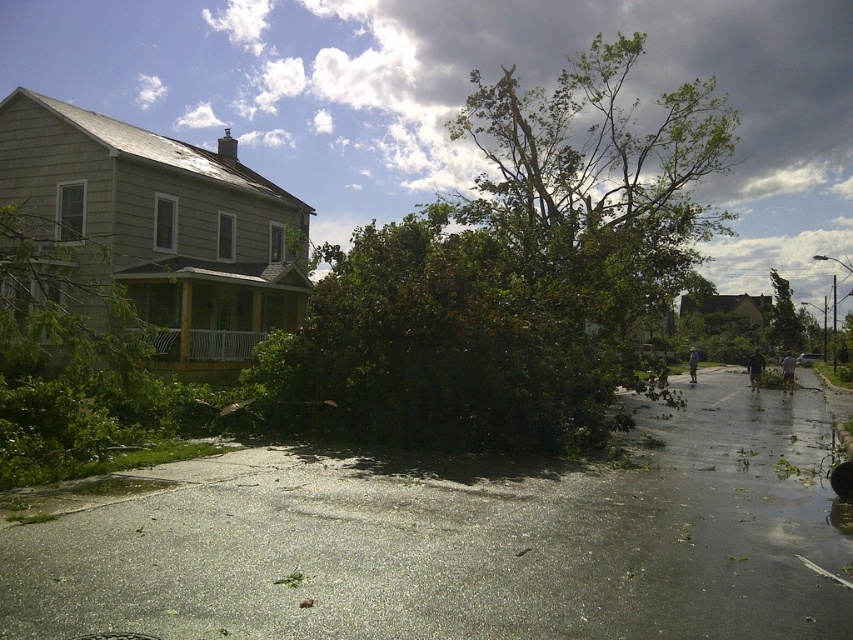
You are a gardener assessing the damage after a storm. You see a green leafy tree at center and a green leafy tree at right. Which tree is closer to the left side of the street?

The green leafy tree at center is positioned on the left side of the green leafy tree at right, so it is closer to the left side of the street.